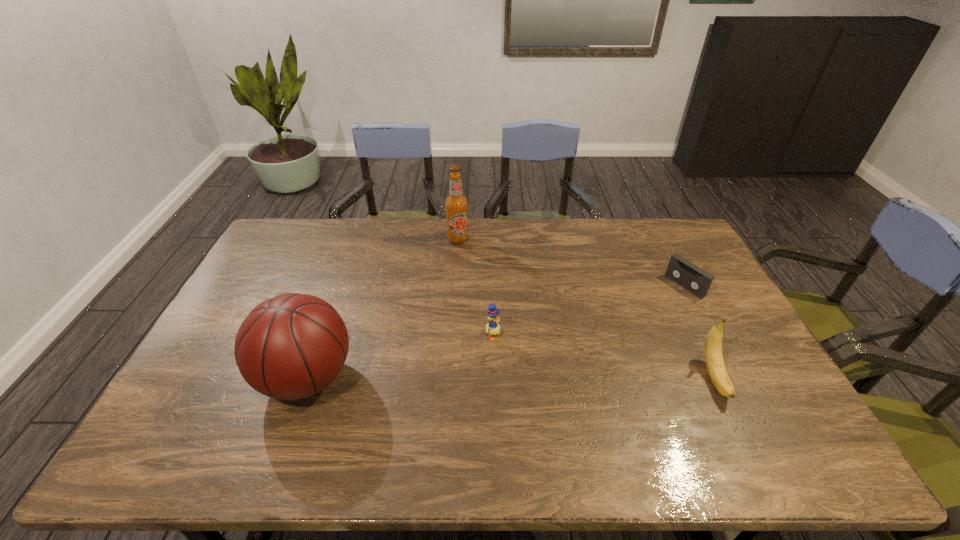
Image resolution: width=960 pixels, height=540 pixels. Identify the location of unoccupied position between the duckling and the farthest object. (475, 287).

Where is `free space that is in between the farthest object and the duckling`? free space that is in between the farthest object and the duckling is located at coordinates (475, 287).

At what (x,y) coordinates should I click in order to perform the action: click on vacant area between the beer bottle and the third object from left to right. Please return your answer as a coordinate pair (x, y). The height and width of the screenshot is (540, 960). Looking at the image, I should click on (475, 287).

What are the coordinates of `free area in between the third object from left to right and the videotape` in the screenshot? It's located at (588, 310).

Locate an element on the screen. Image resolution: width=960 pixels, height=540 pixels. empty space between the second object from left to right and the second shortest object is located at coordinates (475, 287).

This screenshot has width=960, height=540. I want to click on empty space between the third object from left to right and the third shortest object, so click(604, 356).

Identify which object is the second nearest to the beer bottle. Please provide its 2D coordinates. Your answer should be formatted as a tuple, i.e. [(x, y)], where the tuple contains the x and y coordinates of a point satisfying the conditions above.

[(289, 347)]

The height and width of the screenshot is (540, 960). I want to click on object that stands as the third closest to the duckling, so click(713, 345).

The width and height of the screenshot is (960, 540). Identify the location of free point that satisfies the following two spatial constraints: 1. on the front side of the second object from left to right; 2. on the left side of the fourth tallest object. (451, 335).